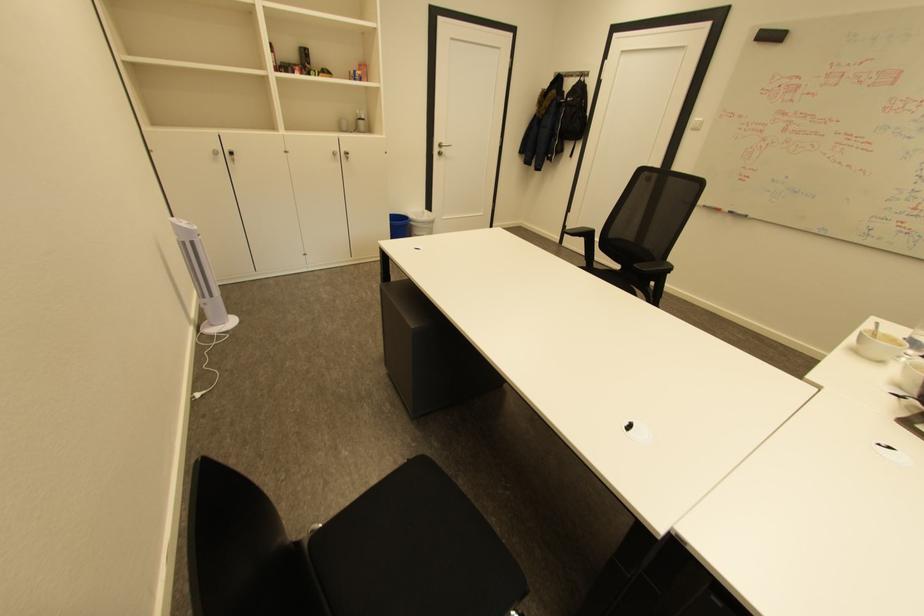
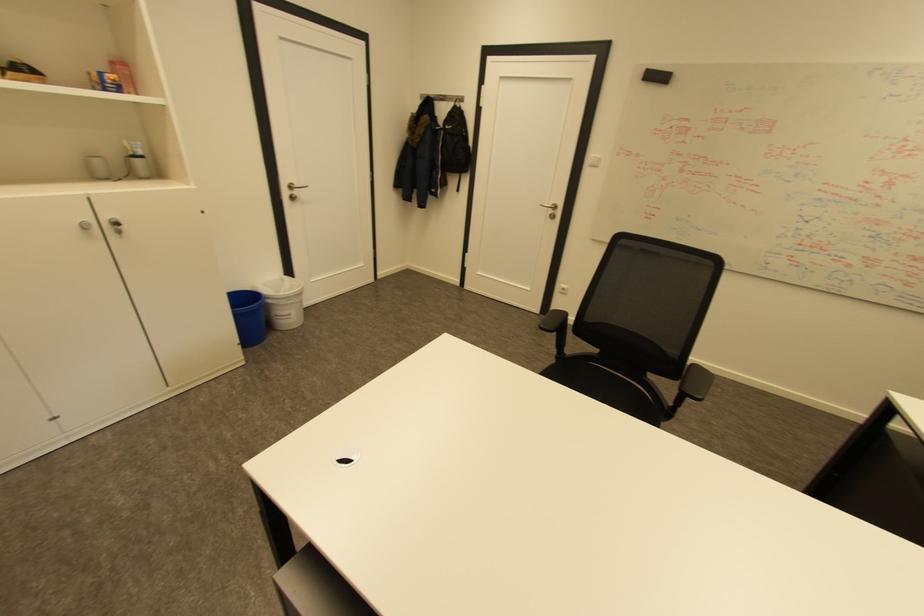
Question: What movement of the cameraman would produce the second image?

Choices:
 (A) Left
 (B) Right
 (C) Forward
 (D) Backward

Answer: (C)